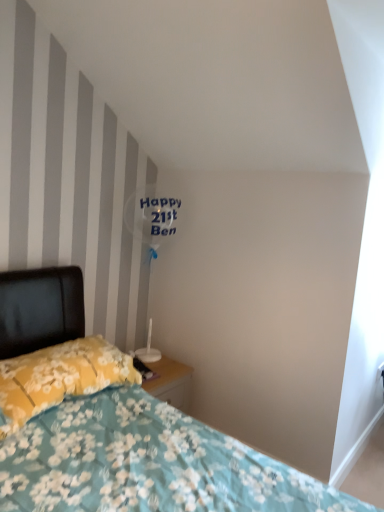
Question: Considering the relative positions of yellow floral fabric pillow at lower left and floral fabric bed at lower left in the image provided, is yellow floral fabric pillow at lower left behind floral fabric bed at lower left?

Choices:
 (A) yes
 (B) no

Answer: (A)

Question: Does yellow floral fabric pillow at lower left appear on the right side of floral fabric bed at lower left?

Choices:
 (A) yes
 (B) no

Answer: (B)

Question: Is floral fabric bed at lower left inside yellow floral fabric pillow at lower left?

Choices:
 (A) no
 (B) yes

Answer: (A)

Question: Is yellow floral fabric pillow at lower left bigger than floral fabric bed at lower left?

Choices:
 (A) no
 (B) yes

Answer: (A)

Question: From a real-world perspective, is yellow floral fabric pillow at lower left located beneath floral fabric bed at lower left?

Choices:
 (A) no
 (B) yes

Answer: (B)

Question: Can you confirm if yellow floral fabric pillow at lower left is thinner than floral fabric bed at lower left?

Choices:
 (A) no
 (B) yes

Answer: (B)

Question: Is floral fabric bed at lower left taller than yellow floral fabric pillow at lower left?

Choices:
 (A) yes
 (B) no

Answer: (A)

Question: Is floral fabric bed at lower left completely or partially outside of yellow floral fabric pillow at lower left?

Choices:
 (A) yes
 (B) no

Answer: (A)

Question: From a real-world perspective, does floral fabric bed at lower left sit lower than yellow floral fabric pillow at lower left?

Choices:
 (A) no
 (B) yes

Answer: (A)

Question: Considering the relative sizes of floral fabric bed at lower left and yellow floral fabric pillow at lower left in the image provided, is floral fabric bed at lower left thinner than yellow floral fabric pillow at lower left?

Choices:
 (A) yes
 (B) no

Answer: (B)

Question: Is floral fabric bed at lower left to the right of yellow floral fabric pillow at lower left from the viewer's perspective?

Choices:
 (A) no
 (B) yes

Answer: (B)

Question: Is the depth of floral fabric bed at lower left less than that of yellow floral fabric pillow at lower left?

Choices:
 (A) no
 (B) yes

Answer: (B)

Question: Which is correct: floral fabric bed at lower left is inside yellow floral fabric pillow at lower left, or outside of it?

Choices:
 (A) outside
 (B) inside

Answer: (A)